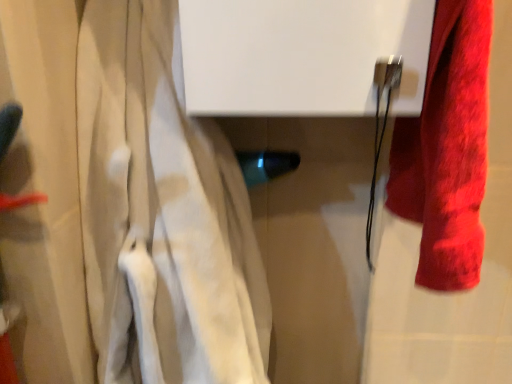
The height and width of the screenshot is (384, 512). What are the coordinates of `velvet red towel at right` in the screenshot? It's located at (447, 149).

The height and width of the screenshot is (384, 512). What do you see at coordinates (447, 149) in the screenshot? I see `velvet red towel at right` at bounding box center [447, 149].

You are a GUI agent. You are given a task and a screenshot of the screen. Output one action in this format:
    pyautogui.click(x=<x>, y=<y>)
    Task: Click on the velvet red towel at right
    This screenshot has width=512, height=384.
    Given the screenshot: What is the action you would take?
    pyautogui.click(x=447, y=149)